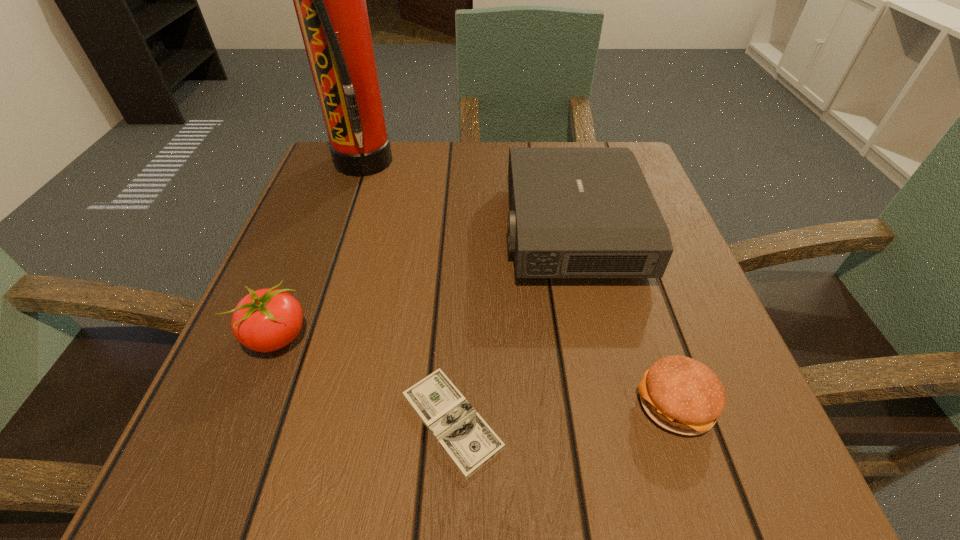
In order to click on fire extinguisher in this screenshot , I will do `click(330, 0)`.

Where is `projector`? The height and width of the screenshot is (540, 960). projector is located at coordinates (575, 212).

At what (x,y) coordinates should I click in order to perform the action: click on tomato. Please return your answer as a coordinate pair (x, y). This screenshot has width=960, height=540. Looking at the image, I should click on (265, 320).

This screenshot has height=540, width=960. I want to click on hamburger, so click(x=680, y=394).

The width and height of the screenshot is (960, 540). I want to click on the shortest object, so click(467, 439).

Find the location of a particular element. Image resolution: width=960 pixels, height=540 pixels. the third object from right to left is located at coordinates (467, 439).

You are a GUI agent. You are given a task and a screenshot of the screen. Output one action in this format:
    pyautogui.click(x=<x>, y=<y>)
    Task: Click on the vacant region located with the nozzle pointing from the back of the fire extinguisher
    
    Given the screenshot: What is the action you would take?
    pyautogui.click(x=518, y=162)

Where is `vacant area located on the front-facing side of the projector`? Image resolution: width=960 pixels, height=540 pixels. vacant area located on the front-facing side of the projector is located at coordinates (412, 230).

Locate an element on the screen. This screenshot has width=960, height=540. free space located on the front-facing side of the projector is located at coordinates (418, 230).

Identify the location of free space located 0.180m on the front-facing side of the projector. The width and height of the screenshot is (960, 540). (412, 230).